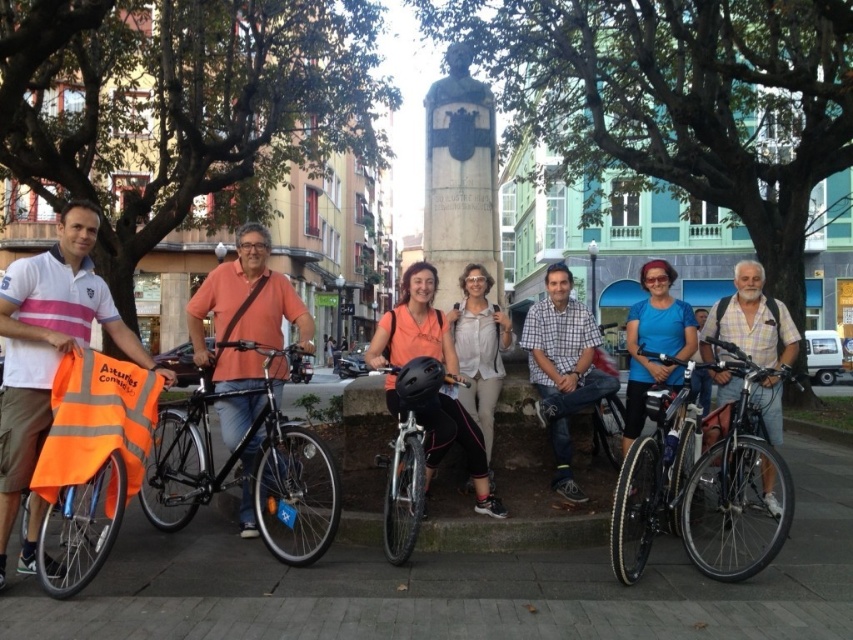
Question: Considering the relative positions of gray concrete pavement at center and matte black helmet at center in the image provided, where is gray concrete pavement at center located with respect to matte black helmet at center?

Choices:
 (A) right
 (B) left

Answer: (B)

Question: Can you confirm if matte white polo shirt at left is positioned to the left of orange fabric bag at center?

Choices:
 (A) no
 (B) yes

Answer: (B)

Question: Which object is closer to the camera taking this photo?

Choices:
 (A) orange fabric bag at center
 (B) white matte jacket at center
 (C) black matte bicycle at center
 (D) gray concrete pavement at center

Answer: (D)

Question: Is shiny metallic bicycle at center behind white matte jacket at center?

Choices:
 (A) no
 (B) yes

Answer: (A)

Question: Which point is farther from the camera taking this photo?

Choices:
 (A) click(381, 460)
 (B) click(440, 637)
 (C) click(479, 204)

Answer: (C)

Question: Which of these objects is positioned closest to the white matte jacket at center?

Choices:
 (A) checkered shirt at center
 (B) shiny metallic bicycle at right
 (C) green stone statue at center
 (D) black matte bicycle at center

Answer: (A)